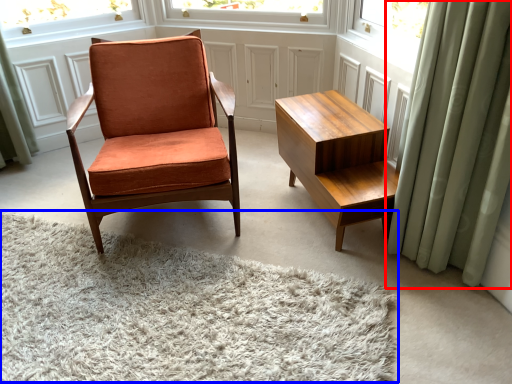
Question: Among these objects, which one is farthest to the camera, curtain (highlighted by a red box) or plain (highlighted by a blue box)?

Choices:
 (A) curtain
 (B) plain

Answer: (A)